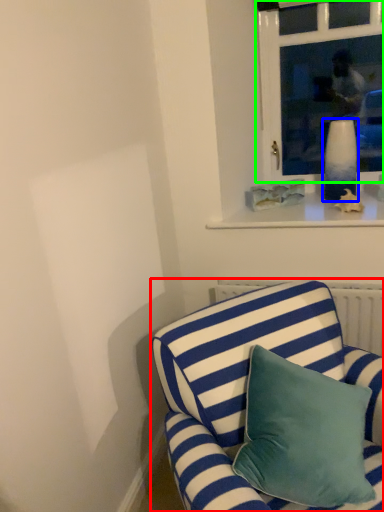
Question: Estimate the real-world distances between objects in this image. Which object is closer to studio couch (highlighted by a red box), vase (highlighted by a blue box) or window (highlighted by a green box)?

Choices:
 (A) vase
 (B) window

Answer: (A)